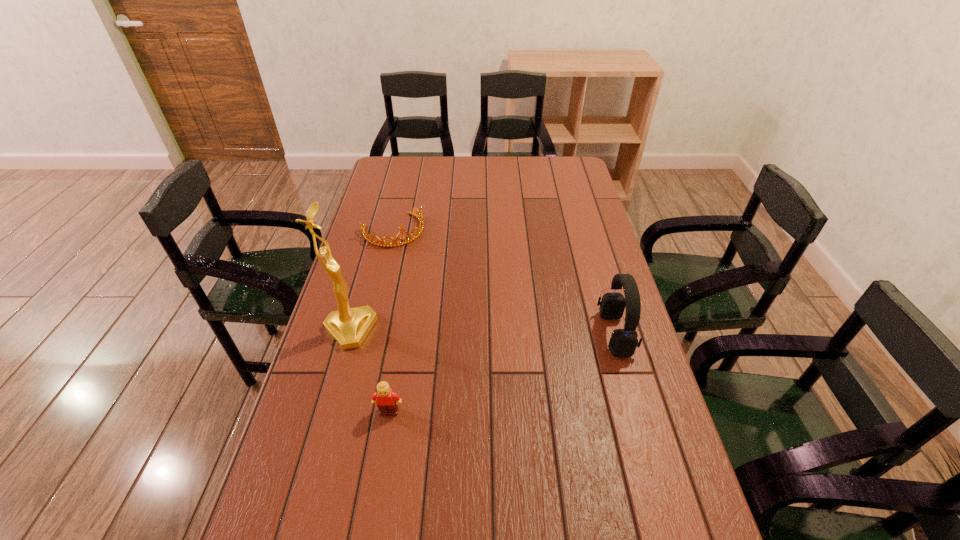
Locate an element on the screen. free space on the desktop that is between the nearest object and the headset and is positioned on the front-facing side of the tallest object is located at coordinates (528, 363).

I want to click on vacant space on the desktop that is between the nearest object and the second tallest object and is positioned on the front-facing side of the farthest object, so click(x=487, y=378).